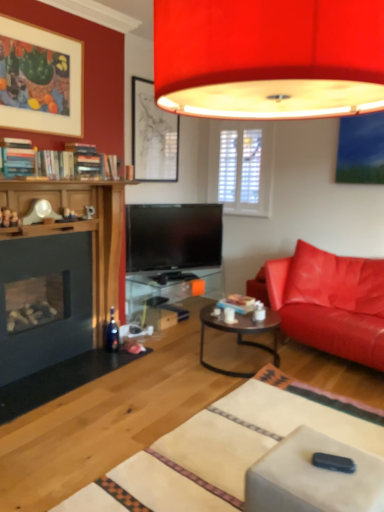
Where is `free space above black plastic swivel chair at center (from a real-world perspective)`? The height and width of the screenshot is (512, 384). free space above black plastic swivel chair at center (from a real-world perspective) is located at coordinates (333, 464).